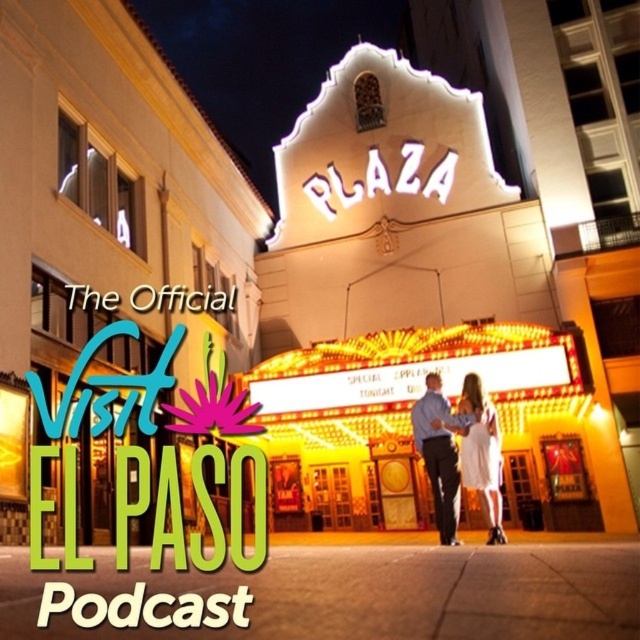
Does point (499, 337) come closer to viewer compared to point (493, 541)?

No, (499, 337) is behind (493, 541).

Who is lower down, yellow neon sign at center or white satin dress at center?

white satin dress at center is below.

Is point (337, 422) positioned in front of point (480, 380)?

No, it is behind (480, 380).

The width and height of the screenshot is (640, 640). In order to click on yellow neon sign at center in this screenshot , I will do `click(412, 378)`.

Is blue shirt at center below white satin dress at center?

Incorrect, blue shirt at center is not positioned below white satin dress at center.

Between blue shirt at center and white satin dress at center, which one appears on the left side from the viewer's perspective?

blue shirt at center is more to the left.

Between point (422, 460) and point (470, 442), which one is positioned behind?

The point (422, 460) is more distant.

Locate an element on the screen. Image resolution: width=640 pixels, height=640 pixels. blue shirt at center is located at coordinates (x=440, y=452).

Is yellow neon sign at center further to camera compared to blue shirt at center?

Yes, yellow neon sign at center is further from the viewer.

Is point (545, 337) closer to viewer compared to point (412, 435)?

That is True.

Find the location of a particular element. yellow neon sign at center is located at coordinates (412, 378).